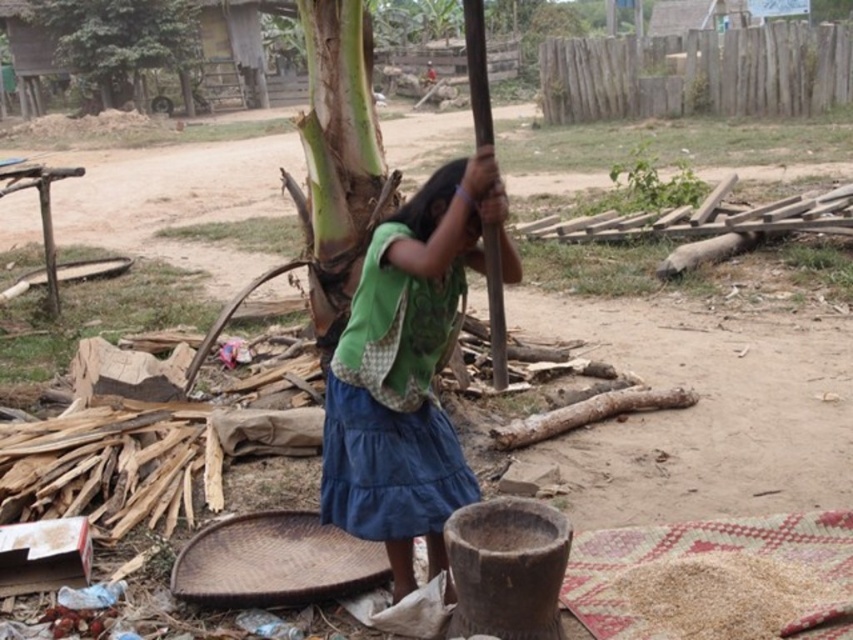
Is green fabric bag at center closer to camera compared to green leafy tree at upper left?

Yes.

Does point (421, 320) come closer to viewer compared to point (189, 12)?

That is True.

The width and height of the screenshot is (853, 640). Describe the element at coordinates (405, 371) in the screenshot. I see `green fabric bag at center` at that location.

The height and width of the screenshot is (640, 853). In order to click on green fabric bag at center in this screenshot , I will do `click(405, 371)`.

Who is lower down, green fabric bag at center or dark green fabric at center?

Positioned lower is green fabric bag at center.

Between green fabric bag at center and dark green fabric at center, which one appears on the left side from the viewer's perspective?

From the viewer's perspective, green fabric bag at center appears more on the left side.

The image size is (853, 640). Identify the location of green fabric bag at center. (405, 371).

Which of these two, brown wooden pole at center or dark green fabric at center, stands shorter?

With less height is dark green fabric at center.

The image size is (853, 640). I want to click on brown wooden pole at center, so click(x=477, y=70).

Describe the element at coordinates (477, 70) in the screenshot. I see `brown wooden pole at center` at that location.

The image size is (853, 640). I want to click on brown wooden pole at center, so click(x=477, y=70).